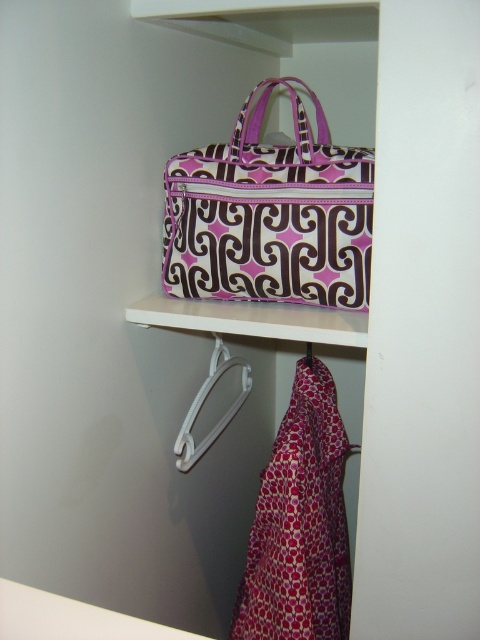
Question: From the image, what is the correct spatial relationship of purple fabric bag at upper center in relation to white plastic hanger at lower center?

Choices:
 (A) right
 (B) left

Answer: (A)

Question: Among these points, which one is nearest to the camera?

Choices:
 (A) (241, 376)
 (B) (325, 300)

Answer: (B)

Question: In this image, where is purple fabric bag at upper center located relative to white plastic hanger at lower center?

Choices:
 (A) above
 (B) below

Answer: (A)

Question: Is purple fabric bag at upper center to the right of white plastic hanger at lower center from the viewer's perspective?

Choices:
 (A) no
 (B) yes

Answer: (B)

Question: Which of the following is the farthest from the observer?

Choices:
 (A) (368, 212)
 (B) (188, 454)

Answer: (B)

Question: Among these objects, which one is nearest to the camera?

Choices:
 (A) white plastic hanger at lower center
 (B) purple fabric bag at upper center

Answer: (B)